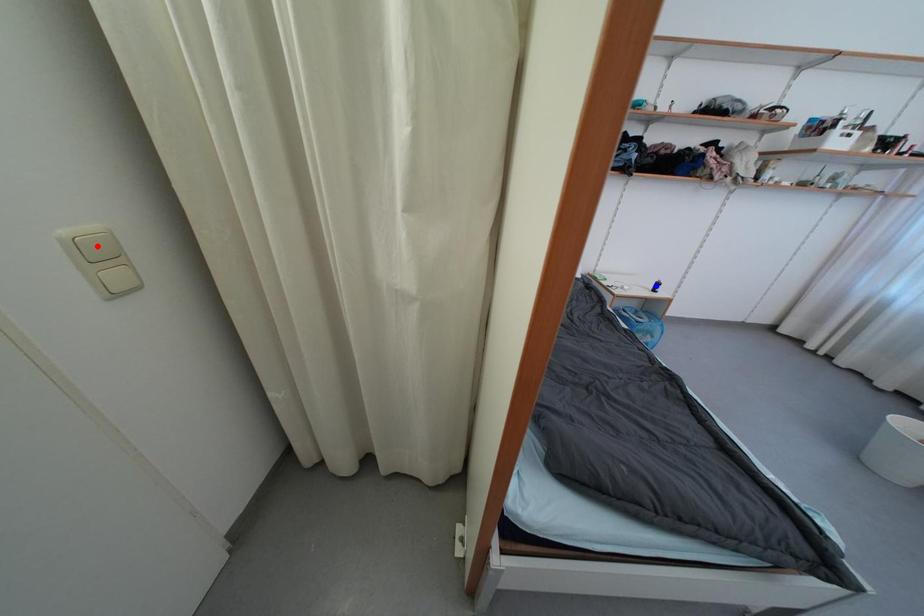
Question: Which of the two points in the image is closer to the camera?

Choices:
 (A) Blue point is closer.
 (B) Red point is closer.

Answer: (B)